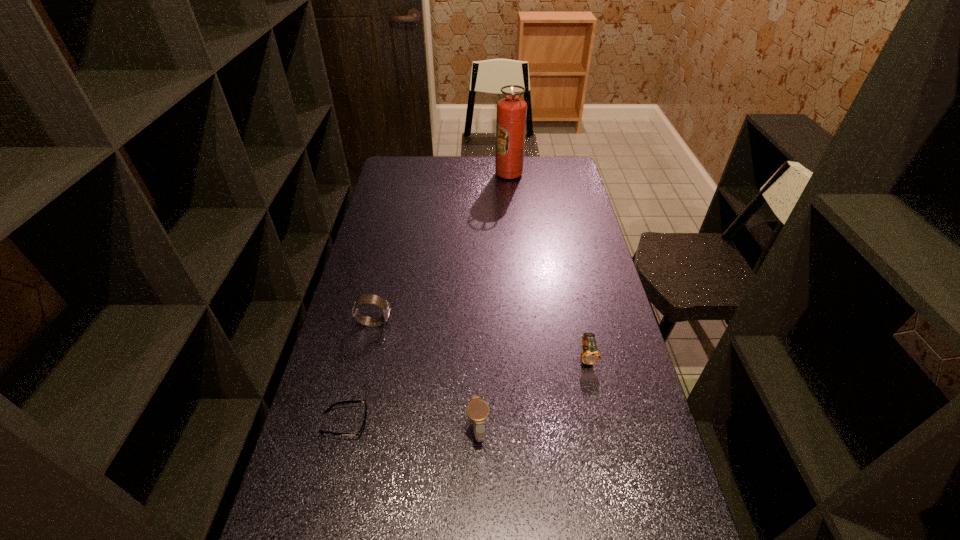
Where is `blank region between the third object from right to left and the shortest object`? Image resolution: width=960 pixels, height=540 pixels. blank region between the third object from right to left and the shortest object is located at coordinates click(x=412, y=426).

I want to click on vacant area that lies between the third object from right to left and the sunglasses, so click(x=412, y=426).

Find the location of a particular element. This screenshot has height=540, width=960. vacant space that is in between the fourth nearest object and the shortest object is located at coordinates (359, 373).

Locate an element on the screen. unoccupied position between the nearest watch and the tallest object is located at coordinates (493, 302).

Select which object is the fourth closest to the fire extinguisher. Please provide its 2D coordinates. Your answer should be formatted as a tuple, i.e. [(x, y)], where the tuple contains the x and y coordinates of a point satisfying the conditions above.

[(360, 432)]

The height and width of the screenshot is (540, 960). Find the location of `object that is the closest one to the second object from right to left`. object that is the closest one to the second object from right to left is located at coordinates (368, 298).

Locate an element on the screen. watch that can be found as the second closest to the shortest object is located at coordinates (368, 298).

Locate which watch is the closest to the shortest object. Please provide its 2D coordinates. Your answer should be formatted as a tuple, i.e. [(x, y)], where the tuple contains the x and y coordinates of a point satisfying the conditions above.

[(477, 410)]

The height and width of the screenshot is (540, 960). Find the location of `free space that satisfies the following two spatial constraints: 1. on the back side of the third object from left to right; 2. on the front-facing side of the shortest object`. free space that satisfies the following two spatial constraints: 1. on the back side of the third object from left to right; 2. on the front-facing side of the shortest object is located at coordinates (479, 423).

Identify the location of free space in the image that satisfies the following two spatial constraints: 1. on the face of the fourth nearest object; 2. on the back side of the second watch from left to right. This screenshot has height=540, width=960. (349, 429).